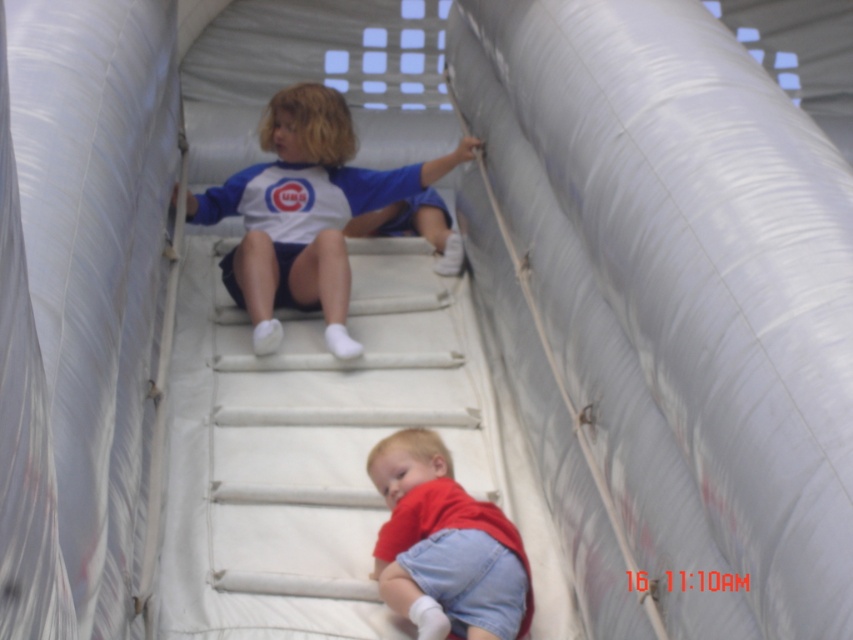
You are a photographer trying to capture a photo of both the blue jersey at center and the red cotton shirt at lower center. Which one should you focus on first if you want to include both in the frame without moving the camera?

The blue jersey at center is positioned on the left side of the red cotton shirt at lower center, so you should focus on the blue jersey at center first to ensure both are in the frame without moving the camera.

You are standing in front of the inflatable slide and want to place a sticker at the point closer to you between the two points, point (x=277, y=172) and point (x=405, y=468). Which point should you choose?

You should choose point (x=277, y=172) because it is closer to you than point (x=405, y=468).